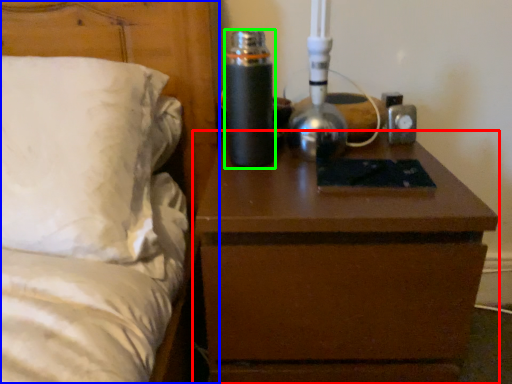
Question: Based on their relative distances, which object is farther from nightstand (highlighted by a red box)? Choose from bed (highlighted by a blue box) and bottle (highlighted by a green box).

Choices:
 (A) bed
 (B) bottle

Answer: (A)